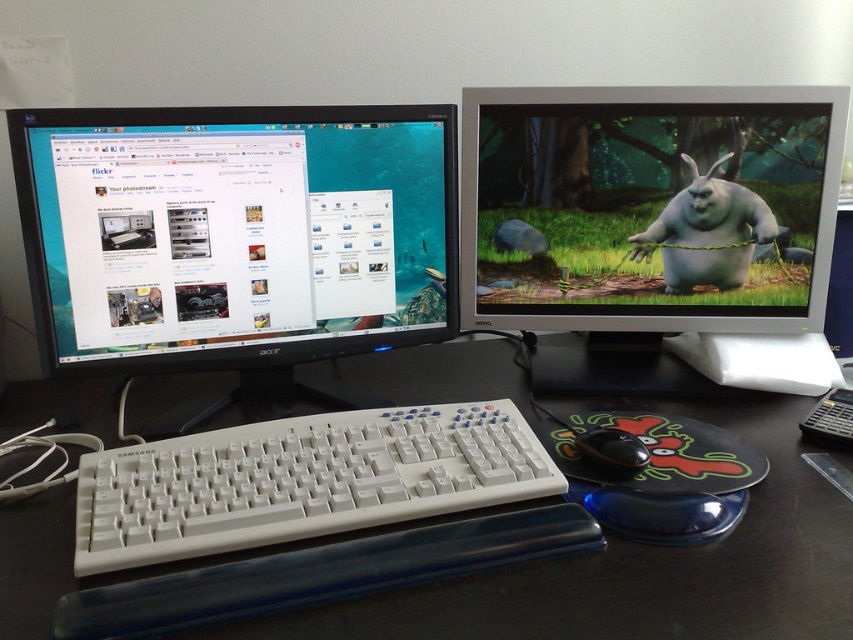
Question: Is black glossy monitor at left in front of matte plastic monitor at right?

Choices:
 (A) no
 (B) yes

Answer: (B)

Question: Which object is the closest to the white plastic keyboard at center?

Choices:
 (A) white rubber rabbit at center
 (B) matte plastic monitor at right
 (C) black plastic computer desk at center

Answer: (C)

Question: Which of the following is the farthest from the observer?

Choices:
 (A) (670, 122)
 (B) (677, 291)
 (C) (55, 352)
 (D) (628, 467)

Answer: (B)

Question: Is black glossy monitor at left wider than black plastic computer desk at center?

Choices:
 (A) no
 (B) yes

Answer: (A)

Question: Which object is positioned closest to the white rubber rabbit at center?

Choices:
 (A) black plastic mouse at center
 (B) matte plastic monitor at right

Answer: (B)

Question: Does black glossy monitor at left appear on the right side of black plastic mouse at center?

Choices:
 (A) no
 (B) yes

Answer: (A)